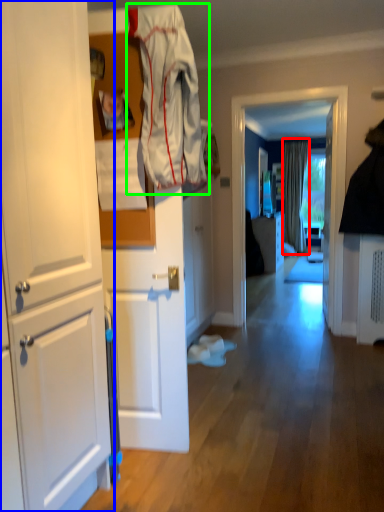
Question: Estimate the real-world distances between objects in this image. Which object is closer to curtain (highlighted by a red box), cabinetry (highlighted by a blue box) or clothing (highlighted by a green box)?

Choices:
 (A) cabinetry
 (B) clothing

Answer: (B)